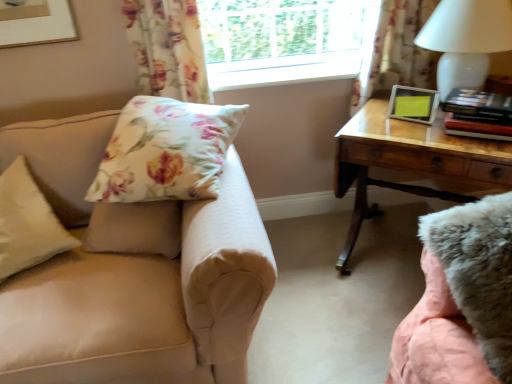
Find the location of `free spot in front of yellow matte picture frame at upper right`. free spot in front of yellow matte picture frame at upper right is located at coordinates (424, 133).